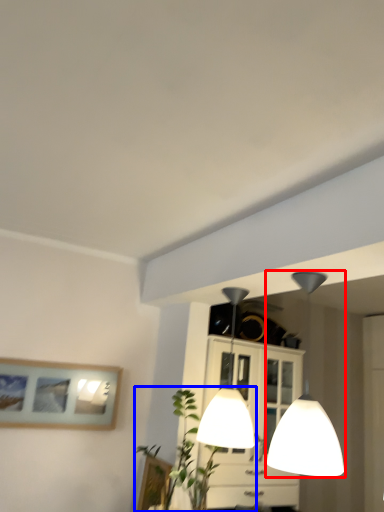
Question: Which point is further to the camera, lamp (highlighted by a red box) or plant (highlighted by a blue box)?

Choices:
 (A) lamp
 (B) plant

Answer: (B)